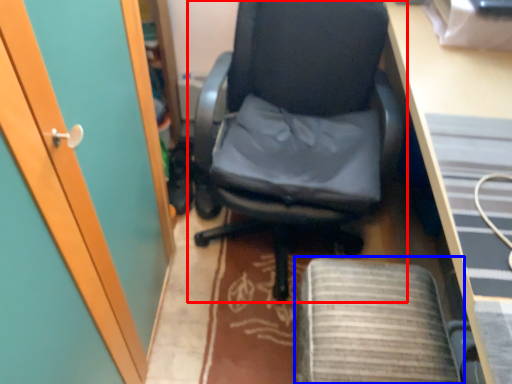
Question: Which object appears farthest to the camera in this image, chair (highlighted by a red box) or computer chair (highlighted by a blue box)?

Choices:
 (A) chair
 (B) computer chair

Answer: (B)